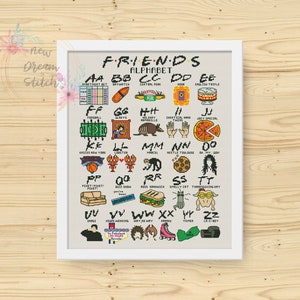
You are a GUI agent. You are given a task and a screenshot of the screen. Output one action in this format:
    pyautogui.click(x=<x>, y=<y>)
    Task: Click on the top of wall
    Image resolution: width=300 pixels, height=300 pixels.
    Given the screenshot: What is the action you would take?
    pyautogui.click(x=147, y=11)